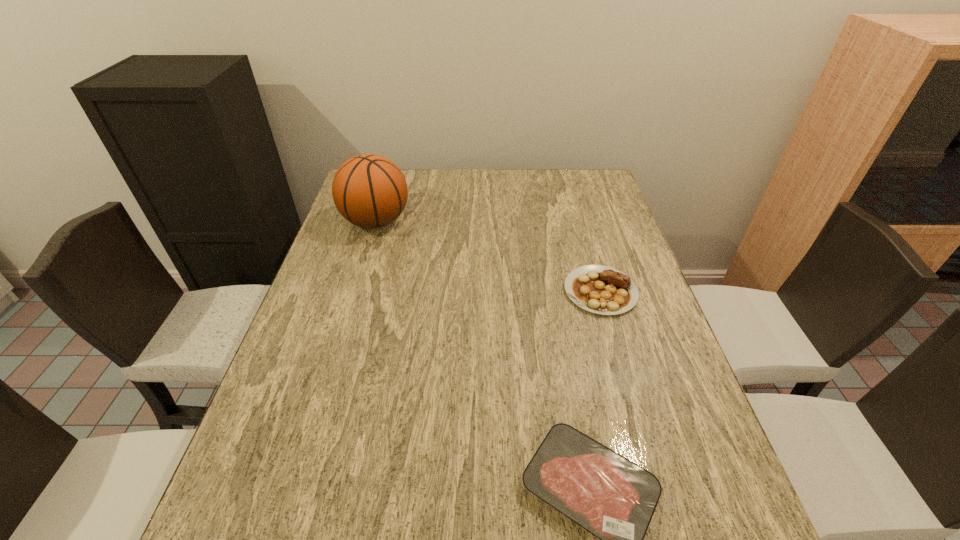
Where is `vacant region at the far edge of the desktop`? This screenshot has width=960, height=540. vacant region at the far edge of the desktop is located at coordinates (418, 181).

In the image, there is a desktop. At what (x,y) coordinates should I click in order to perform the action: click on vacant space at the near edge. Please return your answer as a coordinate pair (x, y). This screenshot has height=540, width=960. Looking at the image, I should click on (395, 531).

At what (x,y) coordinates should I click in order to perform the action: click on vacant space at the left edge. Please return your answer as a coordinate pair (x, y). This screenshot has width=960, height=540. Looking at the image, I should click on (370, 232).

Find the location of a particular element. blank space at the right edge is located at coordinates (594, 231).

Where is `vacant point located between the second tallest object and the farthest object`? vacant point located between the second tallest object and the farthest object is located at coordinates (489, 256).

Find the location of a particular element. Image resolution: width=960 pixels, height=540 pixels. free spot between the farthest object and the second shortest object is located at coordinates (489, 256).

Where is `vacant space that's between the farther steak and the tallest object`? This screenshot has width=960, height=540. vacant space that's between the farther steak and the tallest object is located at coordinates (489, 256).

Image resolution: width=960 pixels, height=540 pixels. In order to click on blank region between the basketball and the second shortest object in this screenshot , I will do `click(489, 256)`.

What are the coordinates of `the second closest object to the tallest object` in the screenshot? It's located at (614, 499).

Locate an element on the screen. This screenshot has height=540, width=960. object that is the closest to the nearer steak is located at coordinates (599, 289).